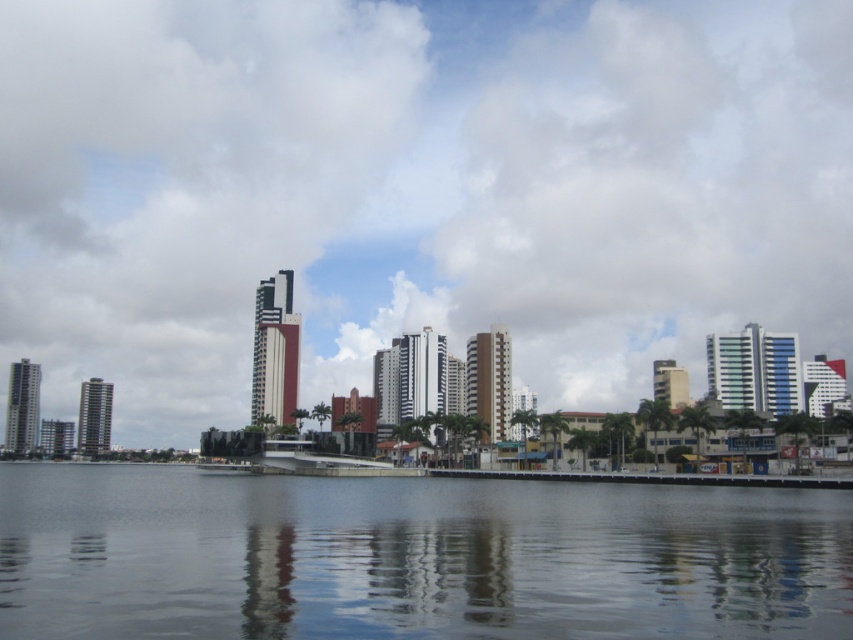
Question: Among these objects, which one is nearest to the camera?

Choices:
 (A) white fluffy cloud at upper center
 (B) transparent glass water at center

Answer: (B)

Question: Which point is closer to the camera?

Choices:
 (A) white fluffy cloud at upper center
 (B) transparent glass water at center

Answer: (B)

Question: Does white fluffy cloud at upper center lie behind transparent glass water at center?

Choices:
 (A) no
 (B) yes

Answer: (B)

Question: Does white fluffy cloud at upper center have a greater width compared to transparent glass water at center?

Choices:
 (A) no
 (B) yes

Answer: (B)

Question: Which of the following is the closest to the observer?

Choices:
 (A) (55, 557)
 (B) (280, 252)

Answer: (A)

Question: Can you confirm if white fluffy cloud at upper center is positioned above transparent glass water at center?

Choices:
 (A) no
 (B) yes

Answer: (B)